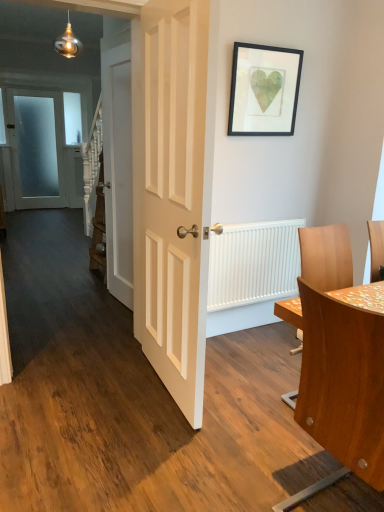
The image size is (384, 512). Identify the location of vacant area that lies to the right of white glossy door at center, the third door from the back. (247, 380).